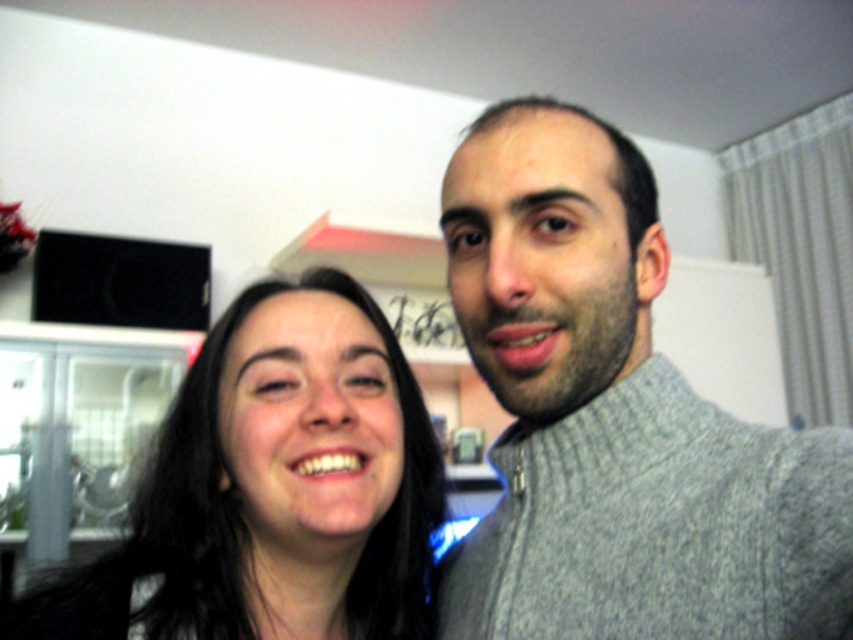
Question: Which of the following is the closest to the observer?

Choices:
 (A) (190, 609)
 (B) (715, 552)

Answer: (B)

Question: Can you confirm if gray knitted sweater at center is positioned below smooth black hair at center?

Choices:
 (A) yes
 (B) no

Answer: (B)

Question: Can you confirm if gray knitted sweater at center is wider than smooth black hair at center?

Choices:
 (A) yes
 (B) no

Answer: (B)

Question: Can you confirm if gray knitted sweater at center is smaller than smooth black hair at center?

Choices:
 (A) no
 (B) yes

Answer: (A)

Question: Which point is closer to the camera?

Choices:
 (A) (90, 593)
 (B) (747, 573)

Answer: (B)

Question: Which of the following is the farthest from the observer?

Choices:
 (A) gray knitted sweater at center
 (B) smooth black hair at center

Answer: (B)